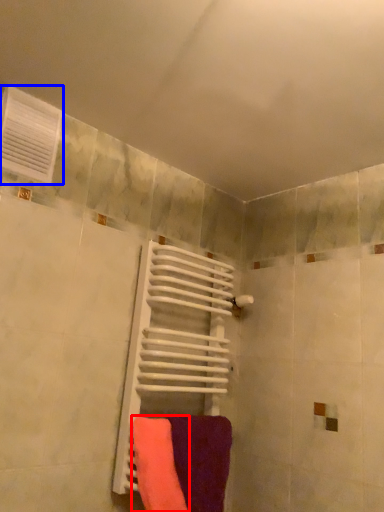
Question: Which object appears closest to the camera in this image, towel (highlighted by a red box) or air conditioning (highlighted by a blue box)?

Choices:
 (A) towel
 (B) air conditioning

Answer: (A)